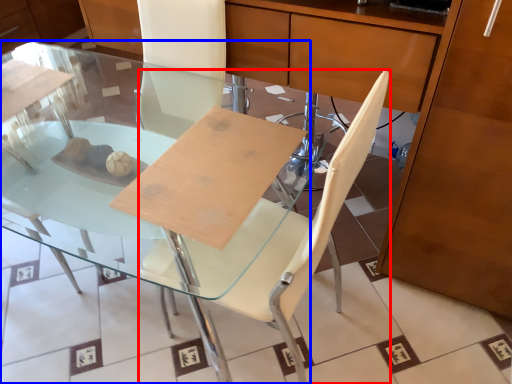
Question: Among these objects, which one is nearest to the camera, chair (highlighted by a red box) or table (highlighted by a blue box)?

Choices:
 (A) chair
 (B) table

Answer: (A)